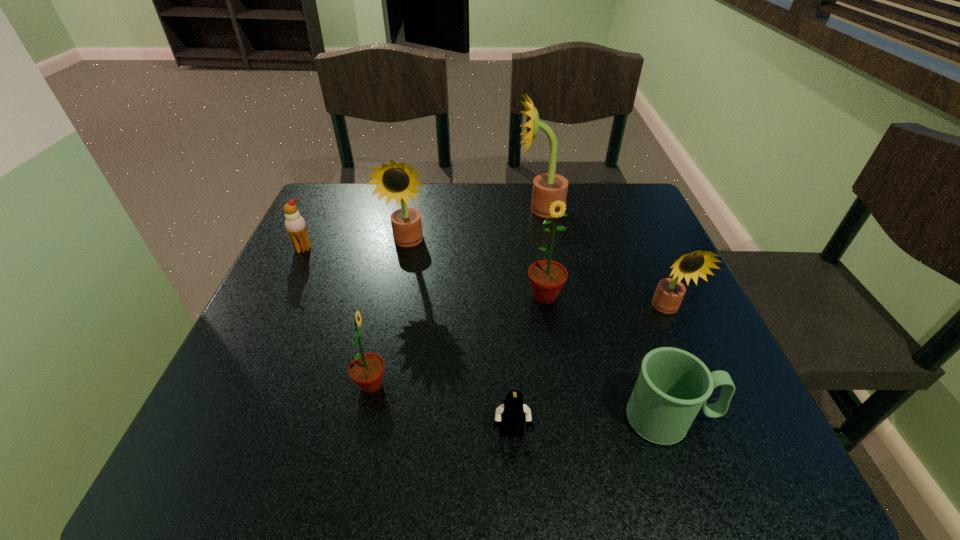
This screenshot has height=540, width=960. I want to click on free spot located 0.110m on the face of the rightmost sunflower, so click(693, 369).

This screenshot has height=540, width=960. Identify the location of free space located at the front with a straw on the leftmost object. (239, 383).

Identify the location of blank space located on the side of the green mug with the handle. (747, 418).

You are a GUI agent. You are given a task and a screenshot of the screen. Output one action in this format:
    pyautogui.click(x=<x>, y=<y>)
    Task: Click on the mug located in the near edge section of the desktop
    The width and height of the screenshot is (960, 540).
    Given the screenshot: What is the action you would take?
    pyautogui.click(x=673, y=385)

Find the location of `Lego located at the near edge`. Lego located at the near edge is located at coordinates (513, 413).

Locate an element on the screen. object at the left edge is located at coordinates (295, 224).

Locate an element on the screen. The width and height of the screenshot is (960, 540). sunflower situated at the right edge is located at coordinates (669, 293).

I want to click on mug located in the right edge section of the desktop, so click(x=673, y=385).

At what (x,y) coordinates should I click in order to perform the action: click on object that is at the near right corner. Please return your answer as a coordinate pair (x, y). The width and height of the screenshot is (960, 540). Looking at the image, I should click on click(673, 385).

This screenshot has height=540, width=960. I want to click on vacant area at the far edge, so click(467, 214).